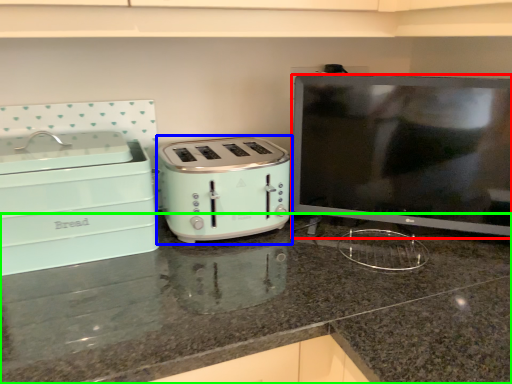
Question: Which object is the closest to the appliance (highlighted by a red box)? Choose among these: toaster (highlighted by a blue box) or countertop (highlighted by a green box).

Choices:
 (A) toaster
 (B) countertop

Answer: (A)